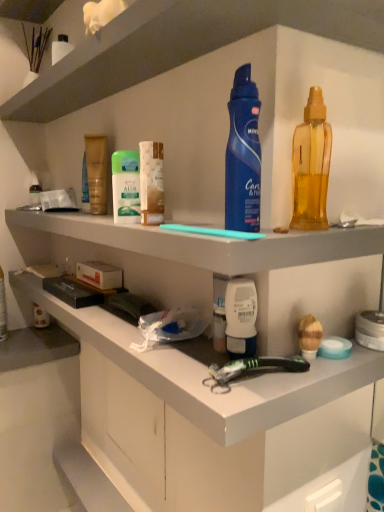
What do you see at coordinates (97, 172) in the screenshot? This screenshot has width=384, height=512. I see `translucent golden lotion at center, the third toiletry positioned from the right` at bounding box center [97, 172].

Find the location of a particular element. white matte cabinet at lower center, marked as the 1th shelf in a bottom-to-top arrangement is located at coordinates (236, 266).

This screenshot has height=512, width=384. I want to click on blue matte deodorant at center, acting as the 2th cleaning product starting from the right, so click(243, 156).

In order to face translucent plastic deodorant stick at center, which is counted as the 2th toiletry, starting from the front, should I rotate leftwards or rightwards?

To face it directly, rotate left by 5.349 degrees.

The image size is (384, 512). Describe the element at coordinates (251, 369) in the screenshot. I see `black plastic toothbrush at lower center` at that location.

What are the coordinates of `metallic silver tube at left, which ranks as the first toiletry in back-to-front order` in the screenshot? It's located at (34, 190).

Find the location of a particular element. matte plastic shelf at upper center, the 2th shelf positioned from the top is located at coordinates (209, 243).

This screenshot has width=384, height=512. I want to click on white matte drawer at lower center, so tap(123, 430).

I want to click on translucent golden lotion at center, arranged as the second toiletry when viewed from the left, so pyautogui.click(x=97, y=172).

Could you measure the distance between white matte drawer at lower center and white matte cabinet at lower center, marked as the 1th shelf in a bottom-to-top arrangement?

The distance of white matte drawer at lower center from white matte cabinet at lower center, marked as the 1th shelf in a bottom-to-top arrangement, is 39.13 centimeters.

Is white matte drawer at lower center wider or thinner than white matte cabinet at lower center, which is the 3th shelf in top-to-bottom order?

white matte drawer at lower center is thinner than white matte cabinet at lower center, which is the 3th shelf in top-to-bottom order.

Is white matte drawer at lower center outside of white matte cabinet at lower center, marked as the 1th shelf in a bottom-to-top arrangement?

white matte drawer at lower center is positioned outside white matte cabinet at lower center, marked as the 1th shelf in a bottom-to-top arrangement.

Locate an element on the screen. Image resolution: width=384 pixels, height=512 pixels. the 1st toiletry below when counting from the translucent yellow liquid at right, which is the first cleaning product in right-to-left order (from the image's perspective) is located at coordinates (151, 183).

Consider the image. Can translucent plastic deodorant stick at center, which is counted as the 2th toiletry, starting from the front, be found inside translucent yellow liquid at right, acting as the second cleaning product starting from the left?

Actually, translucent plastic deodorant stick at center, which is counted as the 2th toiletry, starting from the front, is outside translucent yellow liquid at right, acting as the second cleaning product starting from the left.

From the image's perspective, which is below, translucent yellow liquid at right, acting as the second cleaning product starting from the left, or translucent plastic deodorant stick at center, placed as the second toiletry when sorted from right to left?

translucent plastic deodorant stick at center, placed as the second toiletry when sorted from right to left, appears lower in the image.

Considering the points (309, 158) and (152, 198), which point is in front, point (309, 158) or point (152, 198)?

The point (309, 158) is closer.

Based on the photo, how different are the orientations of black plastic toothbrush at lower center and blue matte deodorant at center, which ranks as the first cleaning product in left-to-right order, in degrees?

black plastic toothbrush at lower center and blue matte deodorant at center, which ranks as the first cleaning product in left-to-right order, are facing 90 degrees away from each other.

From the image's perspective, who appears lower, black plastic toothbrush at lower center or blue matte deodorant at center, which ranks as the first cleaning product in left-to-right order?

black plastic toothbrush at lower center, from the image's perspective.

Is point (227, 386) behind point (240, 136)?

Yes, it is.

Which of these two, metallic silver tube at left, which is the 4th toiletry from front to back, or blue matte deodorant at center, which ranks as the first cleaning product in left-to-right order, stands shorter?

metallic silver tube at left, which is the 4th toiletry from front to back, is shorter.

Is metallic silver tube at left, which is the 4th toiletry from front to back, wider than blue matte deodorant at center, which ranks as the first cleaning product in left-to-right order?

No, metallic silver tube at left, which is the 4th toiletry from front to back, is not wider than blue matte deodorant at center, which ranks as the first cleaning product in left-to-right order.

The image size is (384, 512). Find the location of `toiletry that is the 4th one when counting backward from the blue matte deodorant at center, which ranks as the first cleaning product in left-to-right order`. toiletry that is the 4th one when counting backward from the blue matte deodorant at center, which ranks as the first cleaning product in left-to-right order is located at coordinates coord(34,190).

How much distance is there between metallic silver tube at left, which ranks as the first toiletry in back-to-front order, and blue matte deodorant at center, which ranks as the first cleaning product in left-to-right order?

The distance of metallic silver tube at left, which ranks as the first toiletry in back-to-front order, from blue matte deodorant at center, which ranks as the first cleaning product in left-to-right order, is 33.08 inches.

From the picture: Can you confirm if white plastic toothpaste tube at center, placed as the 1th toiletry when sorted from right to left, is taller than metallic silver tube at left, placed as the first toiletry when sorted from left to right?

Indeed, white plastic toothpaste tube at center, placed as the 1th toiletry when sorted from right to left, has a greater height compared to metallic silver tube at left, placed as the first toiletry when sorted from left to right.

Which is more distant, (240,312) or (31,187)?

The point (31,187) is farther.

Can you tell me how much white plastic toothpaste tube at center, arranged as the fourth toiletry when viewed from the back, and metallic silver tube at left, which is the 4th toiletry from front to back, differ in facing direction?

0.00321 degrees.

From a real-world perspective, is translucent golden lotion at center, positioned as the 3th toiletry in front-to-back order, physically located above or below translucent plastic deodorant stick at center, which is the 3th toiletry from back to front?

translucent golden lotion at center, positioned as the 3th toiletry in front-to-back order, is situated higher than translucent plastic deodorant stick at center, which is the 3th toiletry from back to front, in the real world.

Based on their positions, is translucent golden lotion at center, arranged as the second toiletry when viewed from the left, located to the left or right of translucent plastic deodorant stick at center, which is counted as the 2th toiletry, starting from the front?

In the image, translucent golden lotion at center, arranged as the second toiletry when viewed from the left, appears on the left side of translucent plastic deodorant stick at center, which is counted as the 2th toiletry, starting from the front.

Is translucent golden lotion at center, the third toiletry positioned from the right, far away from translucent plastic deodorant stick at center, placed as the second toiletry when sorted from right to left?

No.

Does translucent golden lotion at center, positioned as the 3th toiletry in front-to-back order, have a lesser height compared to translucent plastic deodorant stick at center, which is counted as the 2th toiletry, starting from the front?

No.

How many degrees apart are the facing directions of blue matte deodorant at center, which ranks as the first cleaning product in left-to-right order, and white plastic shelf at upper center, which is the 1th shelf from top to bottom?

They differ by 0.000556 degrees in their facing directions.

Identify the location of the 3rd shelf in front of the blue matte deodorant at center, acting as the 2th cleaning product starting from the right. This screenshot has height=512, width=384. (181, 45).

Choose the correct answer: Is blue matte deodorant at center, acting as the 2th cleaning product starting from the right, inside white plastic shelf at upper center, which is the 3th shelf in bottom-to-top order, or outside it?

blue matte deodorant at center, acting as the 2th cleaning product starting from the right, is not inside white plastic shelf at upper center, which is the 3th shelf in bottom-to-top order, it's outside.

Is blue matte deodorant at center, acting as the 2th cleaning product starting from the right, taller or shorter than white plastic shelf at upper center, which is the 1th shelf from top to bottom?

Considering their sizes, blue matte deodorant at center, acting as the 2th cleaning product starting from the right, has more height than white plastic shelf at upper center, which is the 1th shelf from top to bottom.

There is a white matte drawer at lower center. What are the coordinates of `the 1st shelf above it (from the image's perspective)` in the screenshot? It's located at (236, 266).

Find the location of a particular element. toiletry that is the 2nd one below the translucent yellow liquid at right, acting as the second cleaning product starting from the left (from a real-world perspective) is located at coordinates (151, 183).

Based on their spatial positions, is white matte drawer at lower center or translucent yellow liquid at right, acting as the second cleaning product starting from the left, further from white plastic toothpaste tube at center, arranged as the fourth toiletry when viewed from the back?

The object further to white plastic toothpaste tube at center, arranged as the fourth toiletry when viewed from the back, is white matte drawer at lower center.

Which object lies further to the anchor point metallic silver tube at left, which is the fourth toiletry from right to left, white plastic shelf at upper center, which is the 1th shelf from top to bottom, or translucent yellow liquid at right, which is the first cleaning product in right-to-left order?

The object further to metallic silver tube at left, which is the fourth toiletry from right to left, is translucent yellow liquid at right, which is the first cleaning product in right-to-left order.

Looking at the image, which one is located further to translucent yellow liquid at right, which is the first cleaning product in right-to-left order, white plastic shelf at upper center, which is the 3th shelf in bottom-to-top order, or white plastic toothpaste tube at center, arranged as the fourth toiletry when viewed from the back?

white plastic shelf at upper center, which is the 3th shelf in bottom-to-top order, is further to translucent yellow liquid at right, which is the first cleaning product in right-to-left order.

Looking at the image, which one is located further to white matte cabinet at lower center, marked as the 1th shelf in a bottom-to-top arrangement, translucent golden lotion at center, positioned as the 3th toiletry in front-to-back order, or white plastic toothpaste tube at center, arranged as the fourth toiletry when viewed from the back?

translucent golden lotion at center, positioned as the 3th toiletry in front-to-back order, lies further to white matte cabinet at lower center, marked as the 1th shelf in a bottom-to-top arrangement, than the other object.

Looking at the image, which one is located closer to translucent golden lotion at center, the third toiletry positioned from the right, matte plastic shelf at upper center, the second shelf in the bottom-to-top sequence, or metallic silver tube at left, which ranks as the first toiletry in back-to-front order?

matte plastic shelf at upper center, the second shelf in the bottom-to-top sequence.

When comparing their distances from blue matte deodorant at center, which ranks as the first cleaning product in left-to-right order, does translucent yellow liquid at right, acting as the second cleaning product starting from the left, or metallic silver tube at left, which ranks as the first toiletry in back-to-front order, seem further?

The object further to blue matte deodorant at center, which ranks as the first cleaning product in left-to-right order, is metallic silver tube at left, which ranks as the first toiletry in back-to-front order.

Which object lies nearer to the anchor point white matte drawer at lower center, translucent yellow liquid at right, which is the first cleaning product in right-to-left order, or black plastic toothbrush at lower center?

black plastic toothbrush at lower center is positioned closer to the anchor white matte drawer at lower center.

From the image, which object appears to be farther from metallic silver tube at left, which ranks as the first toiletry in back-to-front order, white plastic toothpaste tube at center, placed as the 1th toiletry when sorted from right to left, or blue matte deodorant at center, which ranks as the first cleaning product in left-to-right order?

Among the two, white plastic toothpaste tube at center, placed as the 1th toiletry when sorted from right to left, is located further to metallic silver tube at left, which ranks as the first toiletry in back-to-front order.

You are a GUI agent. You are given a task and a screenshot of the screen. Output one action in this format:
    pyautogui.click(x=<x>, y=<y>)
    Task: Click on the cleaning product between translucent plastic deodorant stick at center, which is counted as the 2th toiletry, starting from the front, and translucent yellow liquid at right, which is the first cleaning product in right-to-left order
    The width and height of the screenshot is (384, 512).
    Given the screenshot: What is the action you would take?
    pyautogui.click(x=243, y=156)

Locate an element on the screen. cleaning product that lies between blue matte deodorant at center, which ranks as the first cleaning product in left-to-right order, and white matte drawer at lower center from top to bottom is located at coordinates (311, 166).

The height and width of the screenshot is (512, 384). Identify the location of tool located between blue matte deodorant at center, acting as the 2th cleaning product starting from the right, and metallic silver tube at left, which is the 4th toiletry from front to back, in the depth direction. (251, 369).

Locate an element on the screen. The image size is (384, 512). drawer positioned between matte plastic shelf at upper center, the second shelf in the bottom-to-top sequence, and metallic silver tube at left, which is the fourth toiletry from right to left, from near to far is located at coordinates (123, 430).